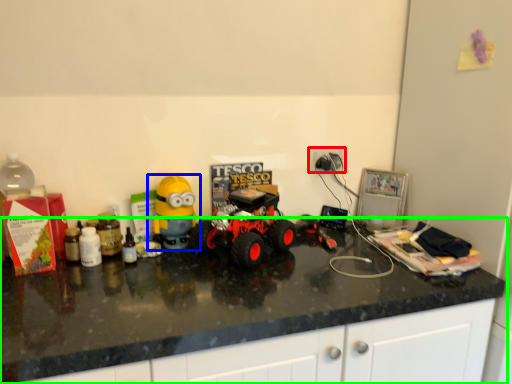
Question: Estimate the real-world distances between objects in this image. Which object is farther from electric outlet (highlighted by a red box), toy (highlighted by a blue box) or countertop (highlighted by a green box)?

Choices:
 (A) toy
 (B) countertop

Answer: (B)